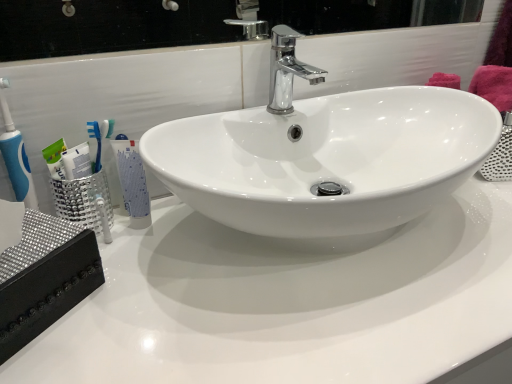
At what (x,y) coordinates should I click in order to perform the action: click on vacant area that is in front of white glossy tube at left. Please return your answer as a coordinate pair (x, y). Looking at the image, I should click on (139, 284).